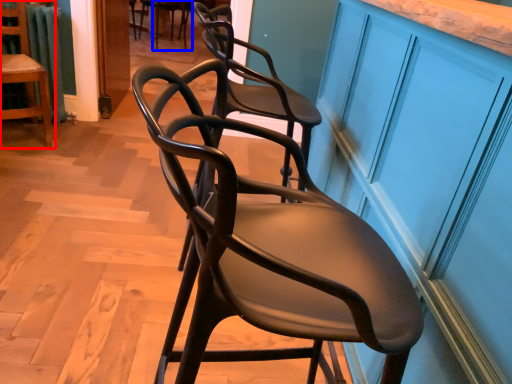
Question: Which of the following is the closest to the observer, chair (highlighted by a red box) or chair (highlighted by a blue box)?

Choices:
 (A) chair
 (B) chair

Answer: (A)